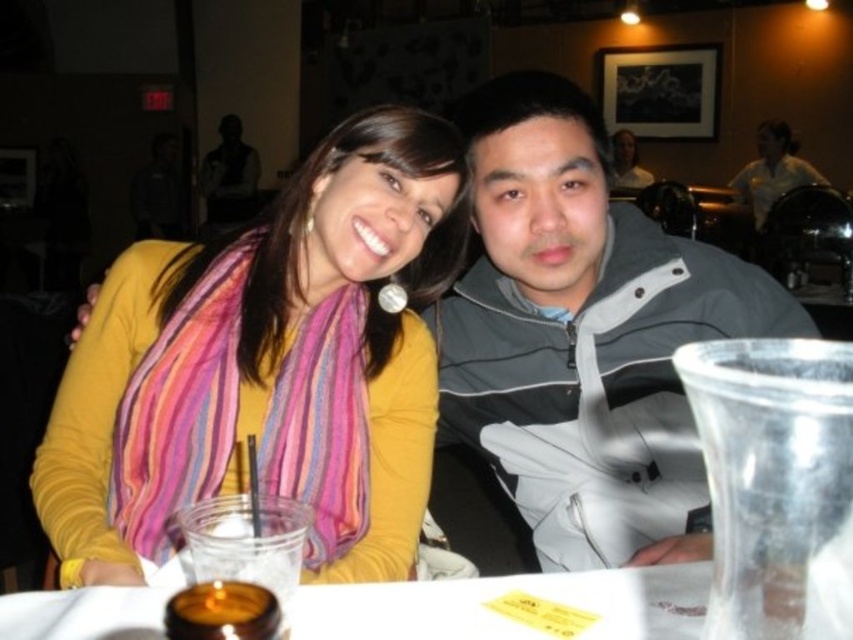
Based on the photo, what are the coordinates of the yellow matte scarf at upper left?

The yellow matte scarf at upper left is located at coordinates point (273,360).

Looking at this image, you are a fashion designer observing the two scarves in the image. The yellow matte scarf at upper left and the multicolored silky scarf at center. You need to decide if they can be displayed together in a showcase that requires a minimum distance of 5 centimeters between items. Based on the scene, what would you advise?

Result: The distance between the yellow matte scarf at upper left and the multicolored silky scarf at center is 4.20 centimeters, which is less than the required 5 centimeters. Therefore, they cannot be displayed together in the showcase as per the requirement.